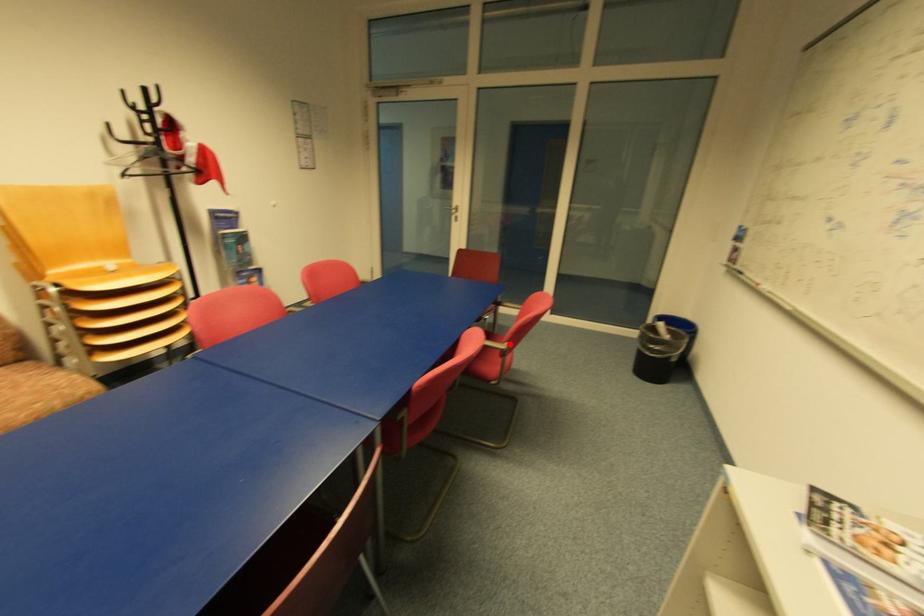
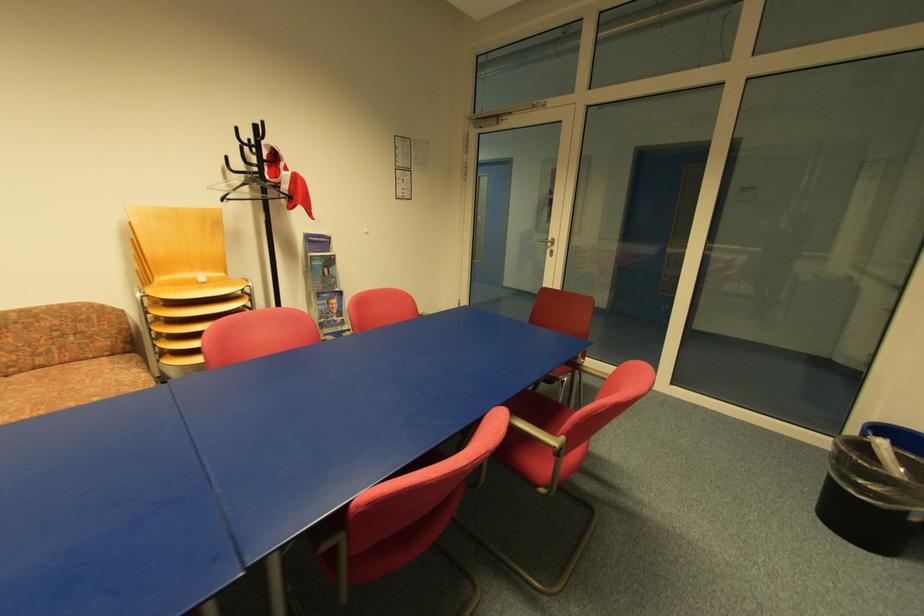
The point at the highlighted location is marked in the first image. Where is the corresponding point in the second image?

(565, 439)